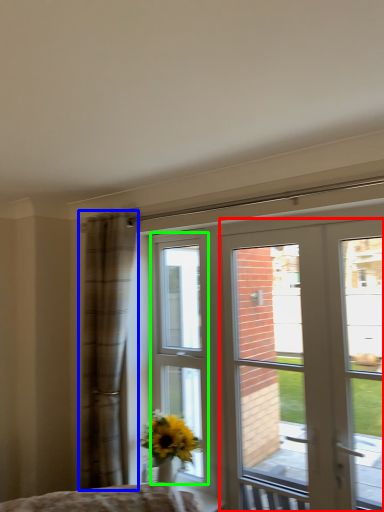
Question: Which object is positioned closest to door (highlighted by a red box)? Select from curtain (highlighted by a blue box) and bay window (highlighted by a green box).

Choices:
 (A) curtain
 (B) bay window

Answer: (A)